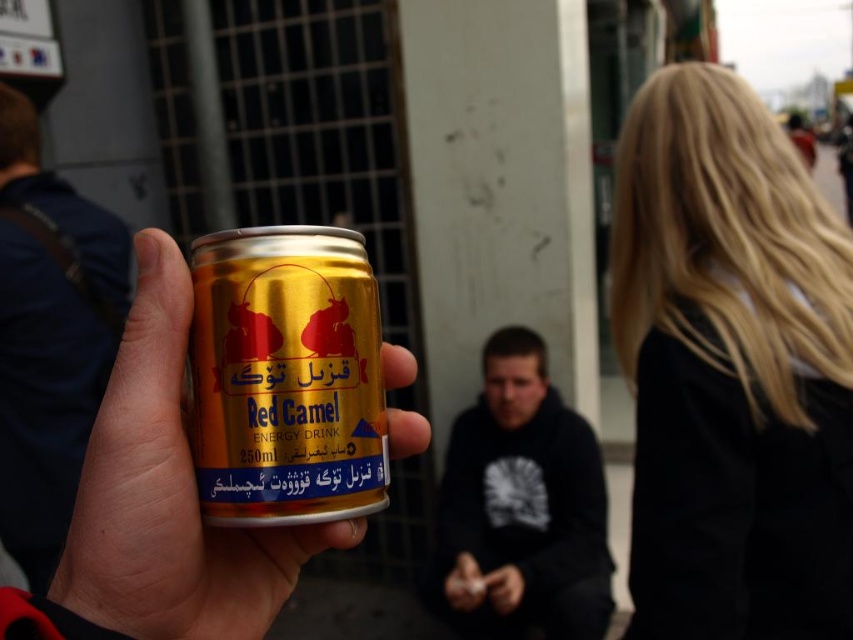
Is blonde hair at upper right closer to camera compared to metallic gold can at left?

No.

Does blonde hair at upper right appear on the right side of metallic gold can at left?

Yes, blonde hair at upper right is to the right of metallic gold can at left.

What do you see at coordinates (730, 369) in the screenshot? I see `blonde hair at upper right` at bounding box center [730, 369].

This screenshot has height=640, width=853. I want to click on blonde hair at upper right, so click(730, 369).

Can you confirm if dark blue hoodie at center is positioned below dark blue fabric shirt at center?

Correct, dark blue hoodie at center is located below dark blue fabric shirt at center.

Can you confirm if dark blue hoodie at center is positioned to the left of dark blue fabric shirt at center?

Incorrect, dark blue hoodie at center is not on the left side of dark blue fabric shirt at center.

Which is in front, point (535, 449) or point (51, 445)?

Point (51, 445) is more forward.

You are a GUI agent. You are given a task and a screenshot of the screen. Output one action in this format:
    pyautogui.click(x=<x>, y=<y>)
    Task: Click on the dark blue hoodie at center
    
    Given the screenshot: What is the action you would take?
    pyautogui.click(x=521, y=508)

Is metallic gold can at left shorter than dark blue hoodie at center?

Yes.

Which of these two, metallic gold can at left or dark blue hoodie at center, stands taller?

With more height is dark blue hoodie at center.

Is point (252, 604) positioned in front of point (517, 529)?

Yes.

The image size is (853, 640). I want to click on metallic gold can at left, so click(x=167, y=497).